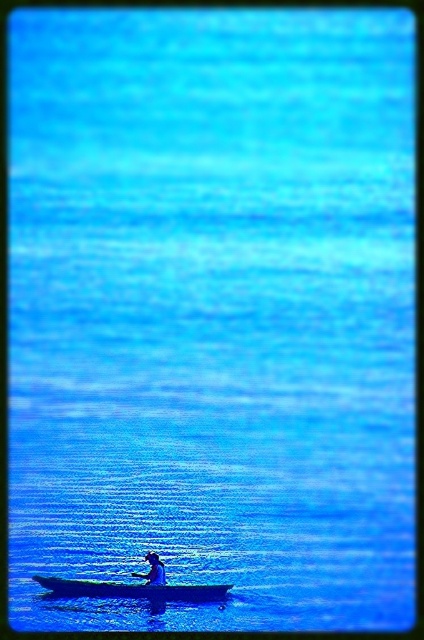
You are planning to take a photo of the dark blue wood canoe at center and the blue matte person at center. Which object should you focus on first if you want to capture both in the same frame without moving the camera?

The dark blue wood canoe at center is wider than the blue matte person at center, so you should focus on the dark blue wood canoe at center first to ensure it fits within the frame.

From the picture: You are standing on the shore of the lake and see the point marked at coordinates (133, 589). What object is located at that point?

The point at coordinates (133, 589) marks the location of the dark blue wood canoe at center.